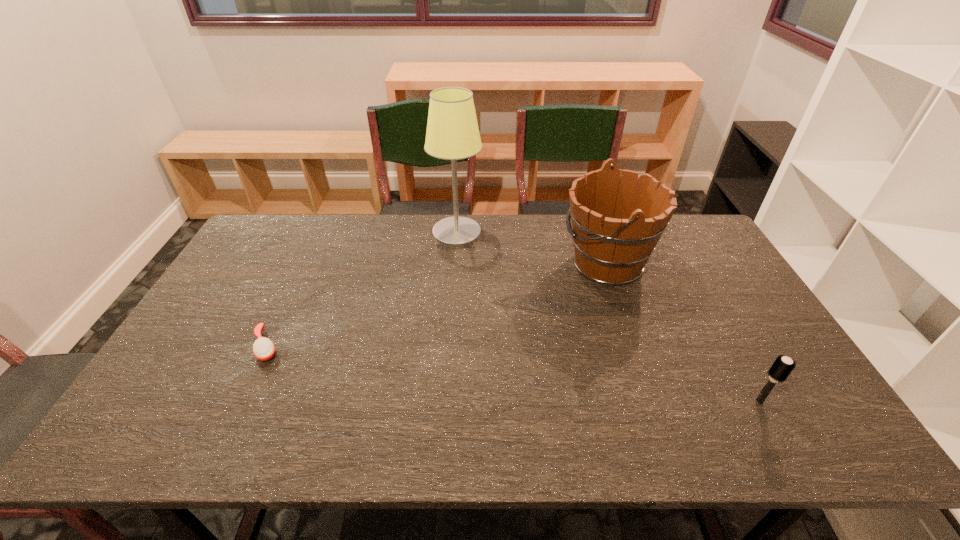
You are a GUI agent. You are given a task and a screenshot of the screen. Output one action in this format:
    pyautogui.click(x=<x>, y=<y>)
    Task: Click on the free space at the right edge
    The width and height of the screenshot is (960, 540).
    Given the screenshot: What is the action you would take?
    pyautogui.click(x=754, y=312)

Identify the location of free spot at the far left corner of the desktop. click(x=273, y=219).

At what (x,y) coordinates should I click in order to perform the action: click on vacant space at the near left corner of the desktop. Please return your answer as a coordinate pair (x, y). The width and height of the screenshot is (960, 540). Looking at the image, I should click on (156, 436).

Where is `vacant area at the far right corner`? This screenshot has width=960, height=540. vacant area at the far right corner is located at coordinates (691, 247).

You are a GUI agent. You are given a task and a screenshot of the screen. Output one action in this format:
    pyautogui.click(x=<x>, y=<y>)
    Task: Click on the free spot between the third object from right to left and the second object from right to left
    
    Given the screenshot: What is the action you would take?
    pyautogui.click(x=532, y=248)

Find the location of a particular element. blank region between the second object from right to left and the tallest object is located at coordinates (532, 248).

This screenshot has width=960, height=540. What are the coordinates of `free space between the nearest object and the left hairbrush` in the screenshot? It's located at (513, 373).

The height and width of the screenshot is (540, 960). In order to click on unoccupied area between the second object from right to left and the left hairbrush in this screenshot , I will do `click(436, 305)`.

Where is `vacant area between the second shortest object and the second object from right to left`? The image size is (960, 540). vacant area between the second shortest object and the second object from right to left is located at coordinates (683, 332).

You are a GUI agent. You are given a task and a screenshot of the screen. Output one action in this format:
    pyautogui.click(x=<x>, y=<y>)
    Task: Click on the free space between the third object from left to right and the third object from right to left
    The width and height of the screenshot is (960, 540).
    Given the screenshot: What is the action you would take?
    pyautogui.click(x=532, y=248)